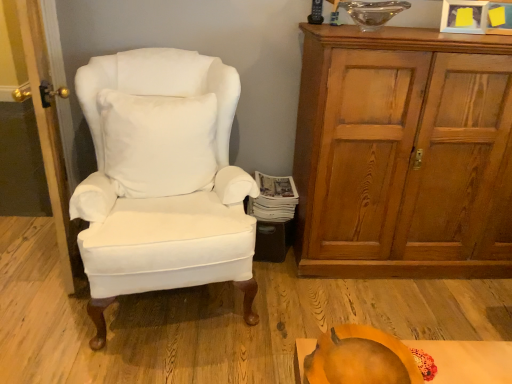
Question: Is orange matte pumpkin at lower center further to the viewer compared to white soft pillow at center?

Choices:
 (A) yes
 (B) no

Answer: (B)

Question: Is orange matte pumpkin at lower center positioned before white soft pillow at center?

Choices:
 (A) no
 (B) yes

Answer: (B)

Question: From the image's perspective, would you say orange matte pumpkin at lower center is shown under white soft pillow at center?

Choices:
 (A) no
 (B) yes

Answer: (B)

Question: Is white soft pillow at center surrounded by orange matte pumpkin at lower center?

Choices:
 (A) no
 (B) yes

Answer: (A)

Question: Considering the relative sizes of orange matte pumpkin at lower center and white soft pillow at center in the image provided, is orange matte pumpkin at lower center smaller than white soft pillow at center?

Choices:
 (A) yes
 (B) no

Answer: (A)

Question: Is orange matte pumpkin at lower center thinner than white soft pillow at center?

Choices:
 (A) no
 (B) yes

Answer: (A)

Question: Is white soft pillow at center next to wooden cabinet at right and touching it?

Choices:
 (A) yes
 (B) no

Answer: (B)

Question: Is white soft pillow at center smaller than wooden cabinet at right?

Choices:
 (A) yes
 (B) no

Answer: (A)

Question: Is white soft pillow at center wider than wooden cabinet at right?

Choices:
 (A) no
 (B) yes

Answer: (A)

Question: Does white soft pillow at center come in front of wooden cabinet at right?

Choices:
 (A) yes
 (B) no

Answer: (A)

Question: Could you tell me if white soft pillow at center is turned towards wooden cabinet at right?

Choices:
 (A) no
 (B) yes

Answer: (A)

Question: Is white soft pillow at center looking in the opposite direction of wooden cabinet at right?

Choices:
 (A) no
 (B) yes

Answer: (A)

Question: Can you confirm if white cotton wingback chair at left is positioned to the right of wooden door at left?

Choices:
 (A) yes
 (B) no

Answer: (A)